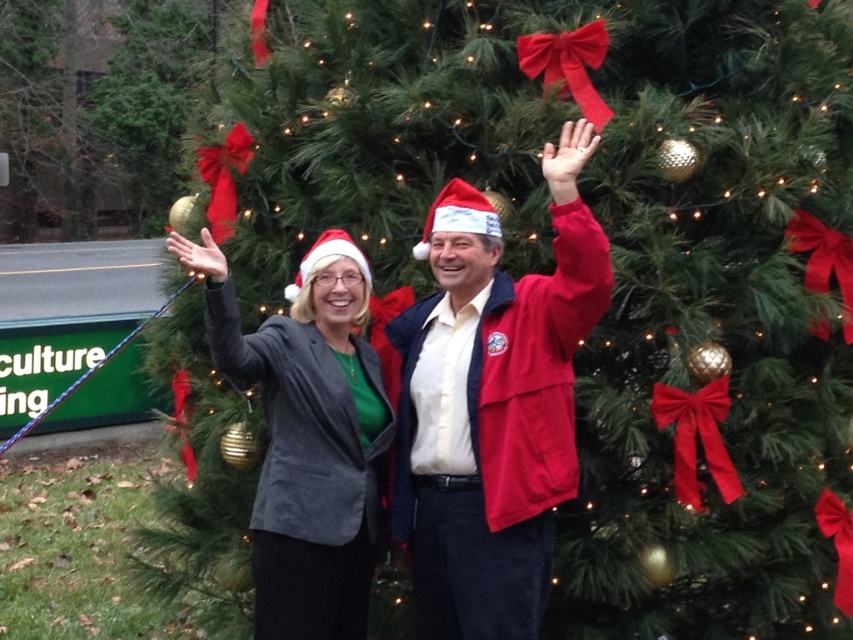
You are organizing a Christmas photo shoot and need to position two props correctly. You have a matte black blazer at center and a shiny gold ornament at left. According to the scene description, which prop is positioned to the right of the other?

The matte black blazer at center is to the right of the shiny gold ornament at left, so the matte black blazer at center is positioned to the right of the shiny gold ornament at left.

You are standing in front of the Christmas tree and want to place a gift at point (579, 333) and another gift at point (3, 209). Which gift will be closer to you?

The gift placed at point (579, 333) will be closer to you because it is closer to the viewer than point (3, 209).